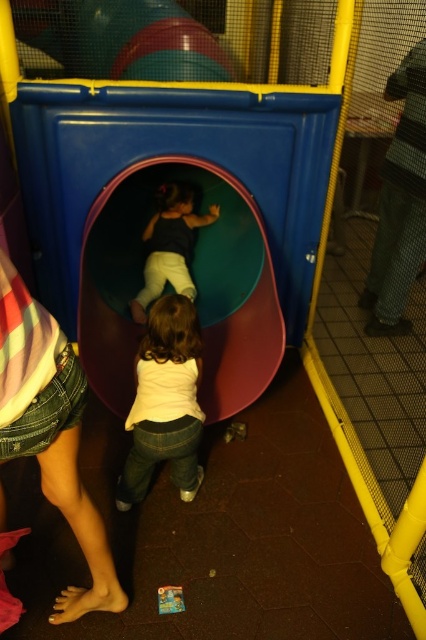
You are standing at the entrance of the play area and see the point marked at coordinates (51, 433). What object is located at that point?

The denim shorts at lower left are located at point (51, 433).

You are standing in the playroom and see two points marked in the image. Which of the two points, point (71,524) or point (147,365), is closer to you?

Point (71,524) is closer to the viewer than point (147,365).

You are a parent supervising two children in the playroom. One child is wearing a matte black shirt at center, and another is climbing into the green rubber slide at center. Based on their positions, which child is closer to the slide?

The child wearing the matte black shirt at center is closer to the green rubber slide at center because the slide is on the right side of the shirt, indicating proximity.